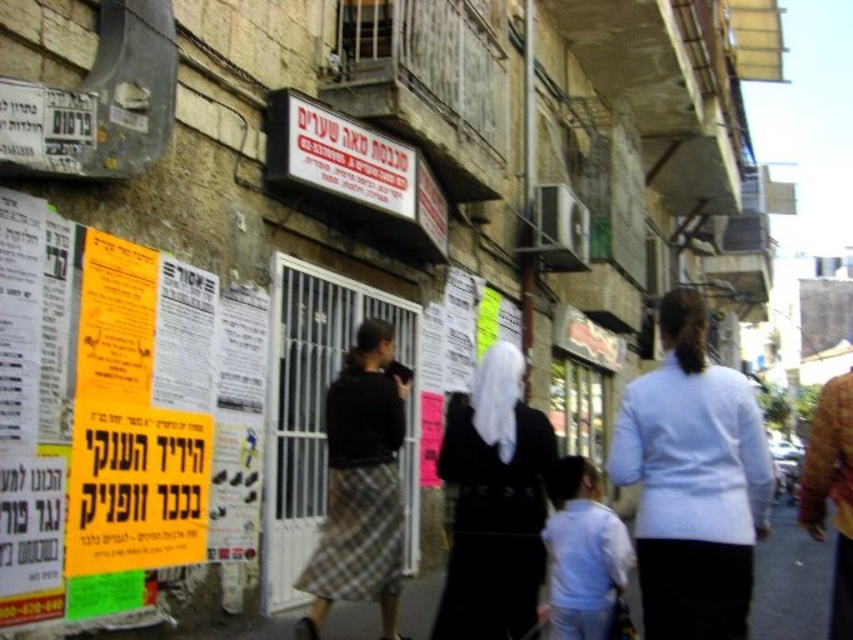
Question: Among these objects, which one is farthest from the camera?

Choices:
 (A) light blue fabric at center
 (B) black matte dress at center

Answer: (B)

Question: Observing the image, what is the correct spatial positioning of black matte dress at center in reference to light blue fabric at lower center?

Choices:
 (A) below
 (B) above

Answer: (B)

Question: Which object is farther from the camera taking this photo?

Choices:
 (A) black matte dress at center
 (B) yellow paper poster at left
 (C) plaid skirt at center

Answer: (C)

Question: Does yellow paper poster at left appear under light blue fabric at lower center?

Choices:
 (A) yes
 (B) no

Answer: (B)

Question: Observing the image, what is the correct spatial positioning of dark blue dress at center in reference to plaid skirt at center?

Choices:
 (A) right
 (B) left

Answer: (A)

Question: Based on their relative distances, which object is nearer to the yellow paper poster at left?

Choices:
 (A) light blue fabric at center
 (B) light blue fabric at lower center

Answer: (B)